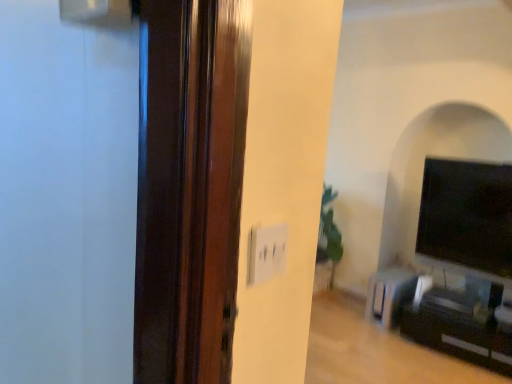
Describe the element at coordinates (389, 295) in the screenshot. The image size is (512, 384). I see `metallic silver speaker at lower right` at that location.

Looking at this image, what is the approximate height of metallic silver speaker at lower right?

It is 15.49 inches.

Image resolution: width=512 pixels, height=384 pixels. What are the coordinates of `black glossy entertainment center at lower right` in the screenshot? It's located at (458, 330).

You are a GUI agent. You are given a task and a screenshot of the screen. Output one action in this format:
    pyautogui.click(x=<x>, y=<y>)
    Task: Click on the metallic silver speaker at lower right
    The width and height of the screenshot is (512, 384).
    Given the screenshot: What is the action you would take?
    pyautogui.click(x=389, y=295)

Between metallic silver speaker at lower right and black glossy entertainment center at lower right, which one has smaller size?

metallic silver speaker at lower right is smaller.

Which of these two, metallic silver speaker at lower right or black glossy entertainment center at lower right, is wider?

metallic silver speaker at lower right.

Is metallic silver speaker at lower right located outside black glossy entertainment center at lower right?

Yes, metallic silver speaker at lower right is located beyond the bounds of black glossy entertainment center at lower right.

Is there a large distance between metallic silver speaker at lower right and black glossy entertainment center at lower right?

They are positioned close to each other.

Looking at this image, is black glossy entertainment center at lower right oriented towards metallic silver speaker at lower right?

No, black glossy entertainment center at lower right is not aimed at metallic silver speaker at lower right.

Is black glossy entertainment center at lower right completely or partially outside of metallic silver speaker at lower right?

Yes, black glossy entertainment center at lower right is not within metallic silver speaker at lower right.

Which is behind, point (443, 328) or point (373, 285)?

Positioned behind is point (373, 285).

From the image's perspective, is black glossy entertainment center at lower right positioned above or below metallic silver speaker at lower right?

Clearly, from the image's perspective, black glossy entertainment center at lower right is below metallic silver speaker at lower right.

Identify the location of wide above the black glossy entertainment center at lower right (from a real-world perspective). The width and height of the screenshot is (512, 384). (467, 217).

Is black glossy entertainment center at lower right inside the boundaries of black glossy tv at right, or outside?

black glossy entertainment center at lower right is outside black glossy tv at right.

From a real-world perspective, which object stands above the other?

black glossy tv at right is physically above.

From the image's perspective, does black glossy entertainment center at lower right appear lower than black glossy tv at right?

Indeed, from the image's perspective, black glossy entertainment center at lower right is shown beneath black glossy tv at right.

Looking at their sizes, would you say black glossy tv at right is wider or thinner than black glossy entertainment center at lower right?

Clearly, black glossy tv at right has less width compared to black glossy entertainment center at lower right.

Is black glossy tv at right inside or outside of black glossy entertainment center at lower right?

black glossy tv at right is outside black glossy entertainment center at lower right.

Is black glossy tv at right bigger than black glossy entertainment center at lower right?

No.

Locate an element on the screen. The height and width of the screenshot is (384, 512). entertainment center in front of the black glossy tv at right is located at coordinates (458, 330).

Is black glossy tv at right positioned far away from metallic silver speaker at lower right?

No, black glossy tv at right is not far from metallic silver speaker at lower right.

Who is smaller, black glossy tv at right or metallic silver speaker at lower right?

metallic silver speaker at lower right.

From the image's perspective, between black glossy tv at right and metallic silver speaker at lower right, which one is located above?

black glossy tv at right, from the image's perspective.

Consider the image. Is metallic silver speaker at lower right turned away from black glossy tv at right?

No, metallic silver speaker at lower right's orientation is not away from black glossy tv at right.

Would you say metallic silver speaker at lower right is a long distance from black glossy tv at right?

No, metallic silver speaker at lower right is in close proximity to black glossy tv at right.

Between metallic silver speaker at lower right and black glossy tv at right, which one has smaller width?

With smaller width is black glossy tv at right.

Considering the sizes of metallic silver speaker at lower right and black glossy tv at right in the image, is metallic silver speaker at lower right taller or shorter than black glossy tv at right?

metallic silver speaker at lower right is shorter than black glossy tv at right.

Image resolution: width=512 pixels, height=384 pixels. Find the location of `entertainment center that appears on the right of metallic silver speaker at lower right`. entertainment center that appears on the right of metallic silver speaker at lower right is located at coordinates (458, 330).

Find the location of a particular element. This screenshot has width=512, height=384. furniture lying behind the black glossy entertainment center at lower right is located at coordinates (389, 295).

Consider the image. From the image, which object appears to be farther from black glossy tv at right, black glossy entertainment center at lower right or metallic silver speaker at lower right?

Among the two, black glossy entertainment center at lower right is located further to black glossy tv at right.

From the image, which object appears to be farther from black glossy tv at right, metallic silver speaker at lower right or black glossy entertainment center at lower right?

Among the two, black glossy entertainment center at lower right is located further to black glossy tv at right.

Based on the photo, when comparing their distances from metallic silver speaker at lower right, does black glossy tv at right or black glossy entertainment center at lower right seem further?

black glossy tv at right is positioned further to the anchor metallic silver speaker at lower right.

Considering their positions, is black glossy tv at right positioned closer to black glossy entertainment center at lower right than metallic silver speaker at lower right?

Based on the image, metallic silver speaker at lower right appears to be nearer to black glossy entertainment center at lower right.

Looking at the image, which one is located closer to metallic silver speaker at lower right, black glossy entertainment center at lower right or black glossy tv at right?

black glossy entertainment center at lower right is positioned closer to the anchor metallic silver speaker at lower right.

Based on their spatial positions, is metallic silver speaker at lower right or black glossy tv at right closer to black glossy entertainment center at lower right?

The object closer to black glossy entertainment center at lower right is metallic silver speaker at lower right.

Where is `furniture between black glossy tv at right and black glossy entertainment center at lower right in the vertical direction`? furniture between black glossy tv at right and black glossy entertainment center at lower right in the vertical direction is located at coordinates [x=389, y=295].